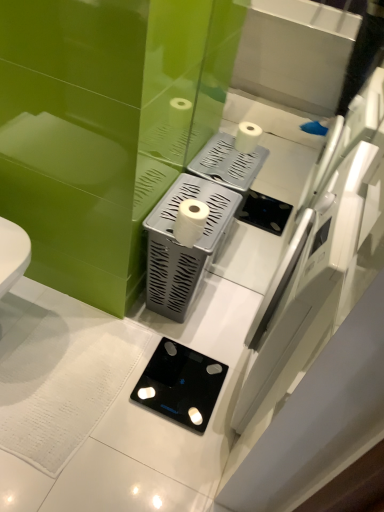
Identify the location of free space between black glass scale at lower center and silver textured tissue holder at center. (189, 335).